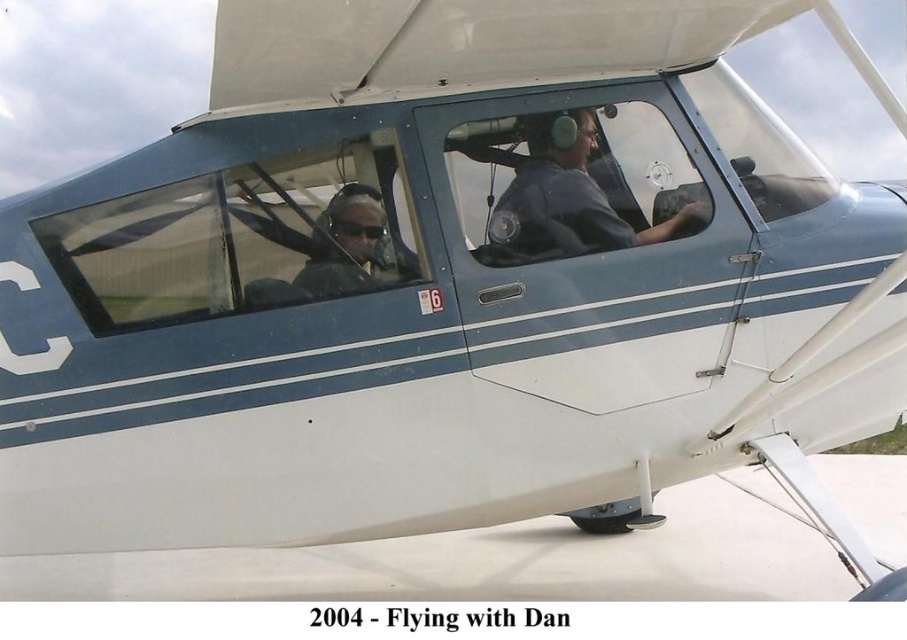
You are a passenger in the cockpit and want to place a small item between the matte black sunglasses at center and the matte black nose at center. Can you fit it there?

The matte black sunglasses at center is much taller than the matte black nose at center, so there might be enough vertical space to place the item between them.

You are a passenger in the cockpit and need to hand a map to the person wearing the matte blue shirt at center. The map is currently on the seat next to the matte black sunglasses at center. Can you reach the map without moving from your seat?

The matte blue shirt at center is closer to you than the matte black sunglasses at center. Since the map is near the sunglasses, you can reach it easily by extending your arm towards the sunglasses, which are farther away but still within reach.

Consider the image. What is the exact location of the matte blue shirt at center in the image?

The matte blue shirt at center is located at point [567,202].